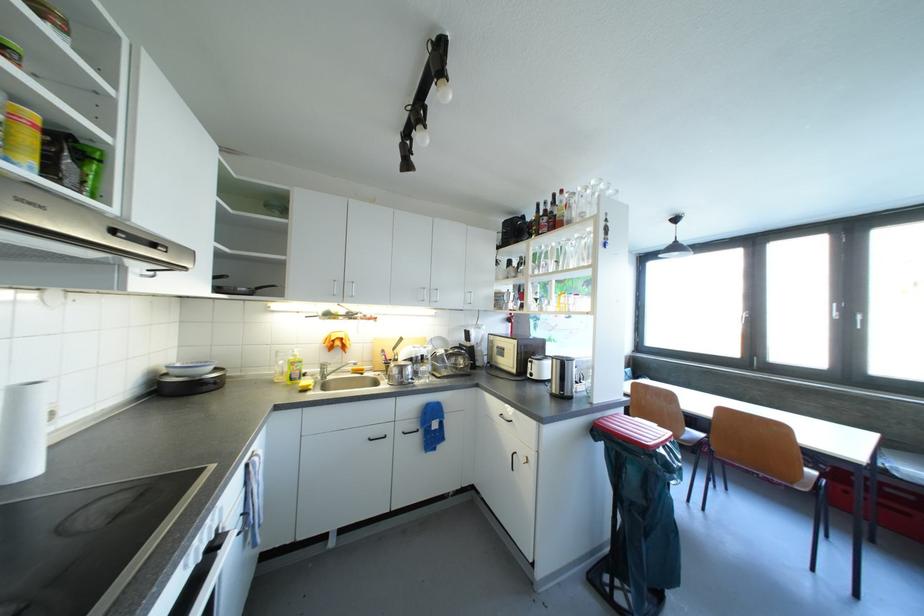
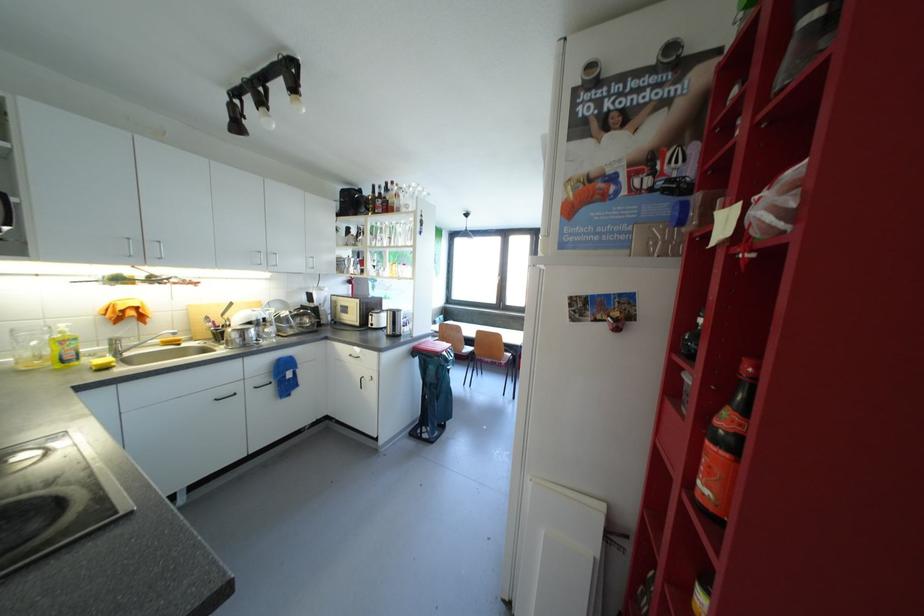
Question: The first image is from the beginning of the video and the second image is from the end. How did the camera likely rotate when shooting the video?

Choices:
 (A) Left
 (B) Right
 (C) Up
 (D) Down

Answer: (B)